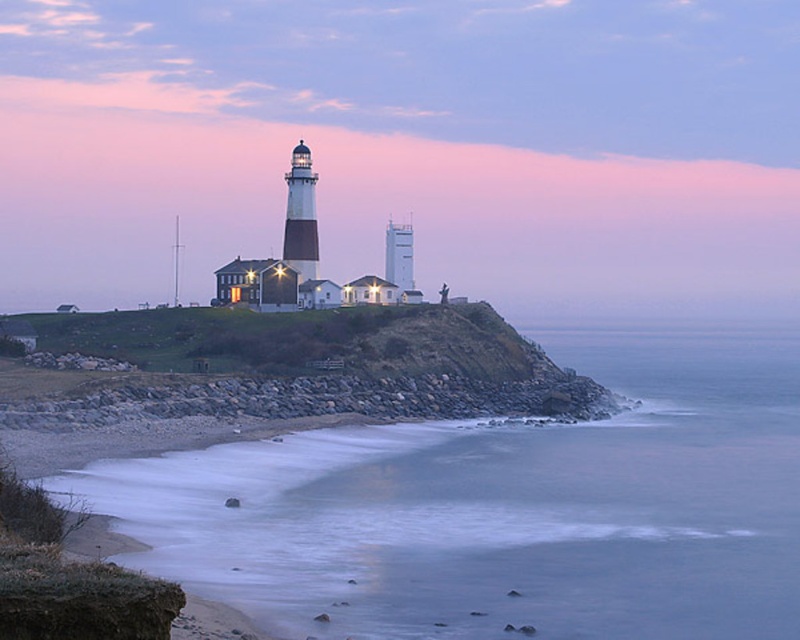
Question: Can you confirm if white matte lighthouse at center is positioned to the right of gray rock wall at lower center?

Choices:
 (A) no
 (B) yes

Answer: (B)

Question: Is blue smooth water at lower left bigger than gray rock wall at lower center?

Choices:
 (A) yes
 (B) no

Answer: (A)

Question: Considering the real-world distances, which object is farthest from the blue smooth water at lower left?

Choices:
 (A) gray rock wall at lower center
 (B) white matte lighthouse at center

Answer: (B)

Question: Can you confirm if blue smooth water at lower left is positioned below gray rock wall at lower center?

Choices:
 (A) no
 (B) yes

Answer: (B)

Question: Which of these objects is positioned closest to the white matte lighthouse at center?

Choices:
 (A) blue smooth water at lower left
 (B) gray rock wall at lower center

Answer: (A)

Question: Estimate the real-world distances between objects in this image. Which object is farther from the blue smooth water at lower left?

Choices:
 (A) gray rock wall at lower center
 (B) white matte lighthouse at center

Answer: (B)